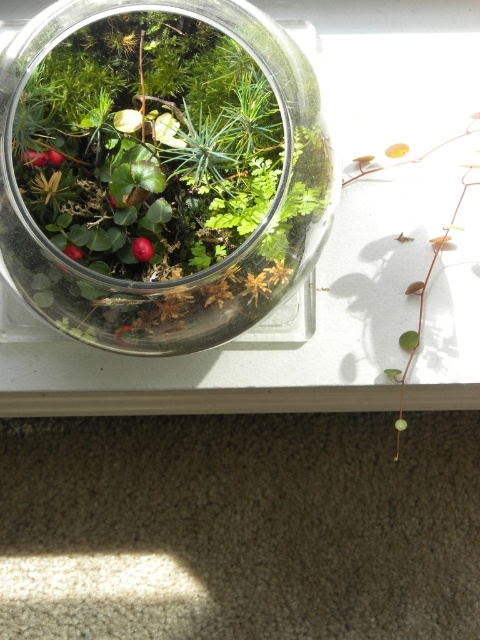
Is point (156, 324) positioned behind point (420, 333)?

No, it is not.

Is transparent glass terrarium at center above green glossy leaf at center?

Yes.

Is point (183, 326) positioned before point (400, 410)?

Yes, it is in front of point (400, 410).

Locate an element on the screen. This screenshot has width=480, height=640. transparent glass terrarium at center is located at coordinates (195, 273).